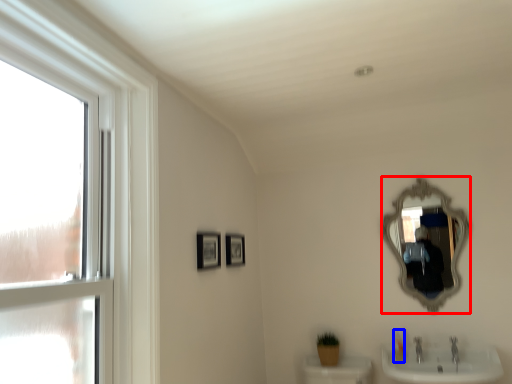
Question: Among these objects, which one is nearest to the camera, mirror (highlighted by a red box) or toiletry (highlighted by a blue box)?

Choices:
 (A) mirror
 (B) toiletry

Answer: (A)